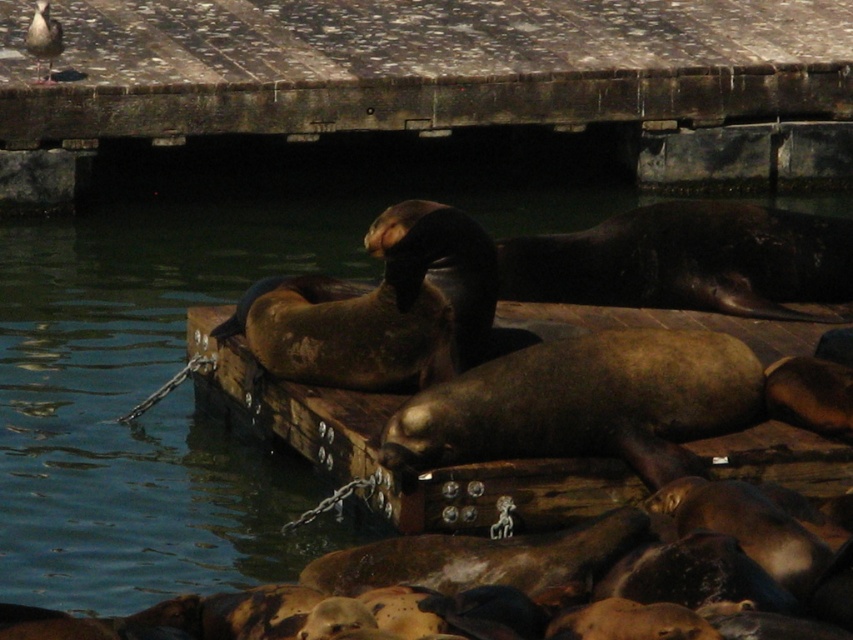
You are a photographer trying to capture the white feathered bird at upper left and the brown water at center in the same frame. Which object will appear larger in your photo?

The brown water at center will appear larger in the photo because it is bigger than the white feathered bird at upper left.

You are a marine biologist observing the harbor. You notice the weathered wood dock at upper center and the brown water at center. Which object occupies a larger area in the image?

The brown water at center occupies a larger area in the image because the weathered wood dock at upper center has a smaller size compared to brown water at center.

You are a marine biologist observing the scene. You need to determine the location of the weathered wood dock at upper center relative to the sea lions. Can you identify its position based on the coordinates provided?

The weathered wood dock at upper center is located at coordinates point [439,80], which places it at the upper center position in the scene.